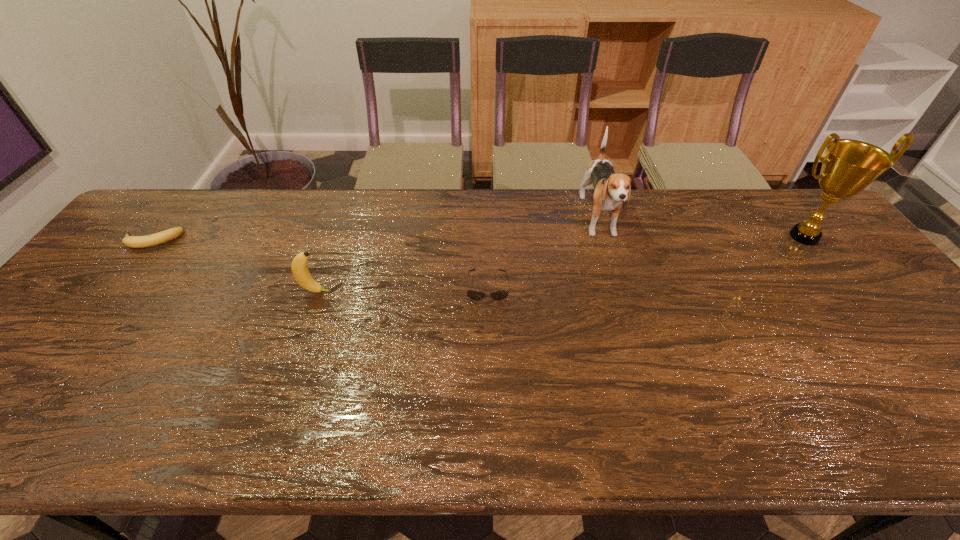
The height and width of the screenshot is (540, 960). Identify the location of the rightmost object. (848, 166).

I want to click on award, so click(x=848, y=166).

The image size is (960, 540). In order to click on the second object from right to left in this screenshot , I will do `click(611, 189)`.

Find the location of `puppy`. puppy is located at coordinates (611, 189).

Identify the location of the taller banana. (299, 267).

Identify the location of the third tallest object. The image size is (960, 540). (299, 267).

At what (x,y) coordinates should I click in order to perform the action: click on the third object from left to right. Please return your answer as a coordinate pair (x, y). The image size is (960, 540). Looking at the image, I should click on (474, 295).

Image resolution: width=960 pixels, height=540 pixels. In order to click on the farther banana in this screenshot , I will do `click(152, 240)`.

Find the location of a particular element. This screenshot has width=960, height=540. the left banana is located at coordinates (152, 240).

Where is `vacant area located on the front view with handles of the rightmost object`? This screenshot has height=540, width=960. vacant area located on the front view with handles of the rightmost object is located at coordinates (877, 330).